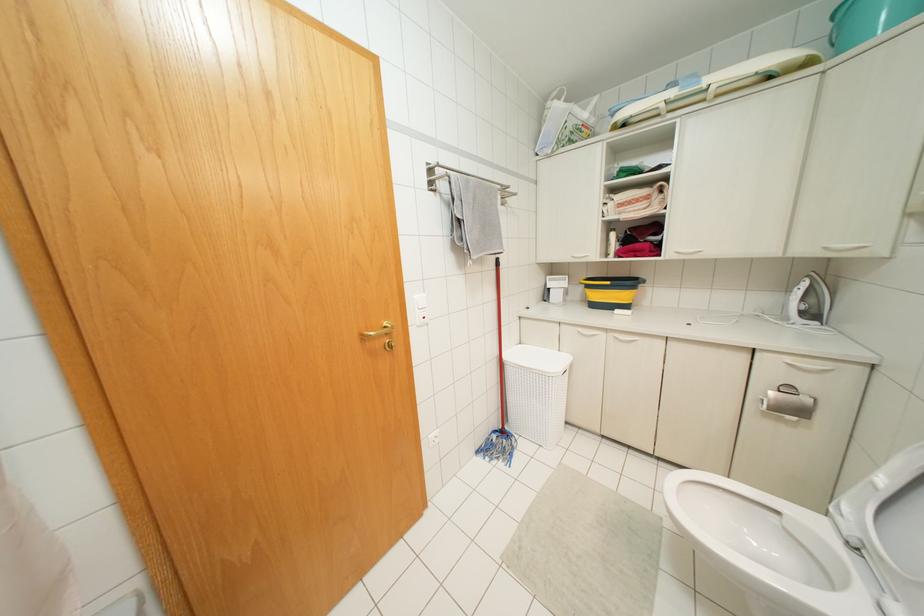
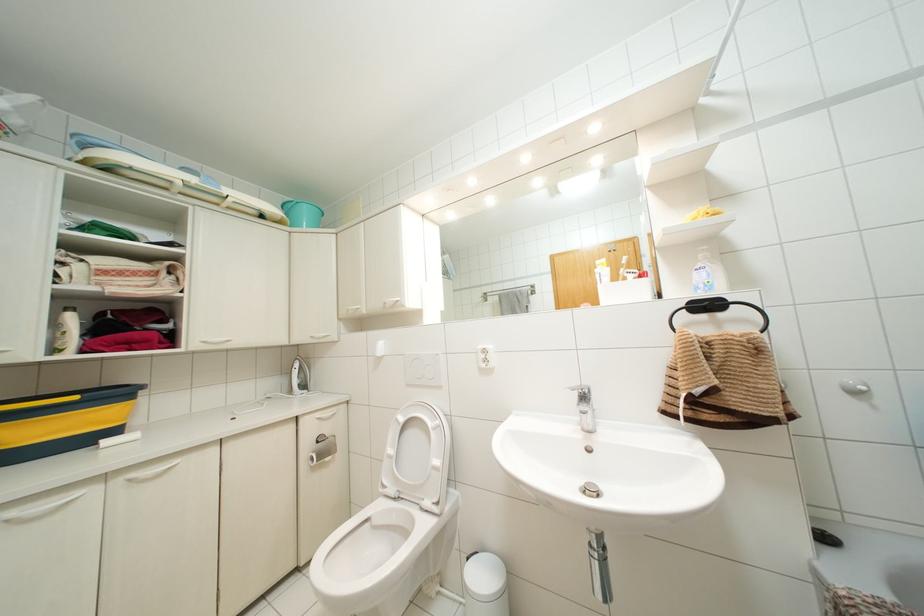
In the second image, find the point that corresponds to the point at 615,334 in the first image.

(132, 475)